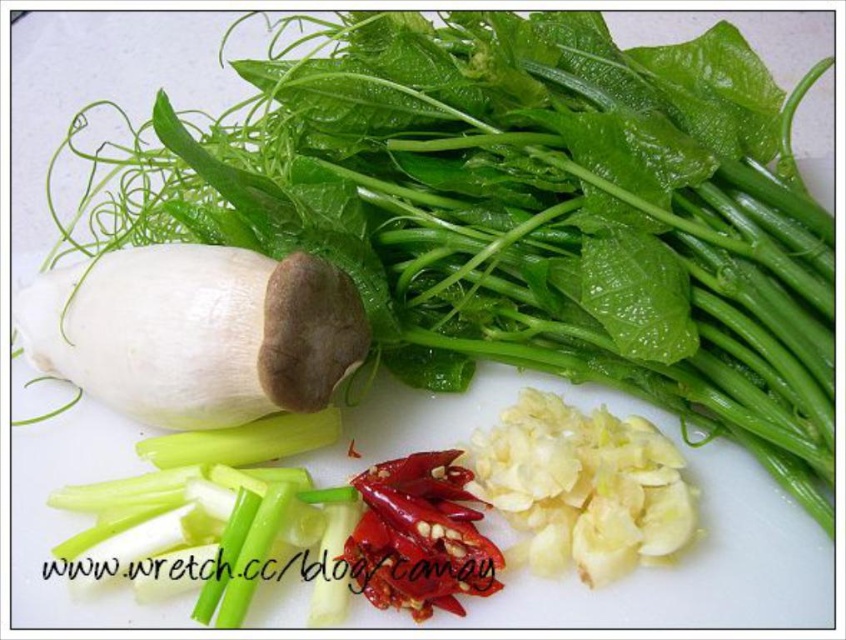
Question: Can you confirm if white matte garlic at center is wider than red matte pepper at center?

Choices:
 (A) yes
 (B) no

Answer: (A)

Question: Is white matte garlic at center bigger than red matte pepper at center?

Choices:
 (A) no
 (B) yes

Answer: (B)

Question: Which of the following is the closest to the observer?

Choices:
 (A) white matte garlic at center
 (B) red matte pepper at center

Answer: (A)

Question: From the image, what is the correct spatial relationship of white matte garlic at center in relation to red matte pepper at center?

Choices:
 (A) above
 (B) below

Answer: (A)

Question: Which of the following is the farthest from the observer?

Choices:
 (A) (310, 374)
 (B) (438, 520)

Answer: (B)